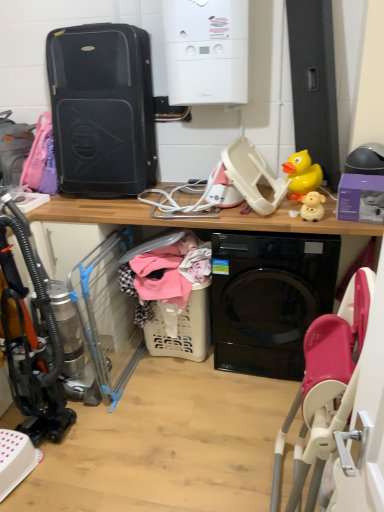
This screenshot has height=512, width=384. What are the coordinates of `white matte sheep at upper right, the 1th toy in the bottom-to-top sequence` in the screenshot? It's located at pos(312,206).

Image resolution: width=384 pixels, height=512 pixels. Describe the element at coordinates (102, 109) in the screenshot. I see `black hard shell suitcase at upper left` at that location.

I want to click on yellow rubber duck at upper right, the second toy positioned from the front, so click(x=302, y=174).

Considering the positions of point (108, 187) and point (309, 205), is point (108, 187) closer or farther from the camera than point (309, 205)?

Clearly, point (108, 187) is more distant from the camera than point (309, 205).

Can you confirm if black hard shell suitcase at upper left is thinner than white matte sheep at upper right, the second toy in the back-to-front sequence?

No.

From a real-world perspective, is black hard shell suitcase at upper left beneath white matte sheep at upper right, the 1th toy in the bottom-to-top sequence?

Actually, black hard shell suitcase at upper left is physically above white matte sheep at upper right, the 1th toy in the bottom-to-top sequence, in the real world.

Which is in front, black hard shell suitcase at upper left or white matte boiler at upper center?

white matte boiler at upper center is more forward.

In the scene shown: Is black hard shell suitcase at upper left thinner than white matte boiler at upper center?

No, black hard shell suitcase at upper left is not thinner than white matte boiler at upper center.

From a real-world perspective, between black hard shell suitcase at upper left and white matte boiler at upper center, who is vertically higher?

white matte boiler at upper center.

Is point (101, 67) more distant than point (178, 49)?

Yes, point (101, 67) is behind point (178, 49).

In terms of height, does black hard shell suitcase at upper left look taller or shorter compared to black glossy washing machine at center?

Considering their sizes, black hard shell suitcase at upper left has less height than black glossy washing machine at center.

From the image's perspective, which is above, black hard shell suitcase at upper left or black glossy washing machine at center?

black hard shell suitcase at upper left, from the image's perspective.

In the scene shown: From a real-world perspective, which object rests below the other?

In real-world perspective, black glossy washing machine at center is lower.

How different are the orientations of black hard shell suitcase at upper left and black glossy washing machine at center in degrees?

They differ by 2.05 degrees in their facing directions.

From a real-world perspective, who is located higher, black glossy washing machine at center or white matte boiler at upper center?

white matte boiler at upper center.

Does point (282, 251) come behind point (166, 9)?

That is True.

Would you say black glossy washing machine at center is outside white matte boiler at upper center?

Yes, black glossy washing machine at center is not within white matte boiler at upper center.

Based on their sizes in the image, would you say black glossy washing machine at center is bigger or smaller than white matte boiler at upper center?

In the image, black glossy washing machine at center appears to be larger than white matte boiler at upper center.

Does point (291, 173) come in front of point (314, 212)?

No, it is behind (314, 212).

At what (x,y) coordinates should I click in order to perform the action: click on toy that is in front of the yellow rubber duck at upper right, the first toy viewed from the top. Please return your answer as a coordinate pair (x, y). The image size is (384, 512). Looking at the image, I should click on (312, 206).

Would you say yellow rubber duck at upper right, acting as the first toy starting from the back, is inside or outside white matte sheep at upper right, the 1th toy in the bottom-to-top sequence?

yellow rubber duck at upper right, acting as the first toy starting from the back, exists outside the volume of white matte sheep at upper right, the 1th toy in the bottom-to-top sequence.

Who is shorter, yellow rubber duck at upper right, the first toy viewed from the top, or white matte sheep at upper right, the 1th toy in the bottom-to-top sequence?

white matte sheep at upper right, the 1th toy in the bottom-to-top sequence, is shorter.

Does yellow rubber duck at upper right, the 2th toy ordered from the bottom, have a larger size compared to black glossy washing machine at center?

No, yellow rubber duck at upper right, the 2th toy ordered from the bottom, is not bigger than black glossy washing machine at center.

From the image's perspective, which is above, yellow rubber duck at upper right, the second toy positioned from the front, or black glossy washing machine at center?

yellow rubber duck at upper right, the second toy positioned from the front, appears higher in the image.

Is yellow rubber duck at upper right, the second toy positioned from the front, placed right next to black glossy washing machine at center?

yellow rubber duck at upper right, the second toy positioned from the front, and black glossy washing machine at center are clearly separated.

Identify the location of washing machine directly beneath the yellow rubber duck at upper right, the second toy positioned from the front (from a real-world perspective). The height and width of the screenshot is (512, 384). (269, 298).

Measure the distance from black glossy washing machine at center to white matte sheep at upper right, the 1th toy in the bottom-to-top sequence.

A distance of 18.63 inches exists between black glossy washing machine at center and white matte sheep at upper right, the 1th toy in the bottom-to-top sequence.

This screenshot has height=512, width=384. Find the location of `the 1st toy behind the black glossy washing machine at center, starting your count from the anchor`. the 1st toy behind the black glossy washing machine at center, starting your count from the anchor is located at coordinates (312, 206).

Are black glossy washing machine at center and white matte sheep at upper right, the second toy in the back-to-front sequence, far apart?

They are positioned close to each other.

Does black glossy washing machine at center contain white matte sheep at upper right, which is the 1th toy from front to back?

No, white matte sheep at upper right, which is the 1th toy from front to back, is located outside of black glossy washing machine at center.

From the image's perspective, count 2nd toys downward from the black hard shell suitcase at upper left and point to it. Please provide its 2D coordinates.

[(312, 206)]

Image resolution: width=384 pixels, height=512 pixels. Find the location of `appliance on the right side of black hard shell suitcase at upper left`. appliance on the right side of black hard shell suitcase at upper left is located at coordinates (206, 51).

When comparing their distances from white matte boiler at upper center, does yellow rubber duck at upper right, the 2th toy ordered from the bottom, or white matte sheep at upper right, which is the 1th toy from front to back, seem further?

white matte sheep at upper right, which is the 1th toy from front to back, is positioned further to the anchor white matte boiler at upper center.

Based on their spatial positions, is yellow rubber duck at upper right, the first toy viewed from the top, or black hard shell suitcase at upper left further from white matte boiler at upper center?

Based on the image, yellow rubber duck at upper right, the first toy viewed from the top, appears to be further to white matte boiler at upper center.

Which object lies further to the anchor point black glossy washing machine at center, black hard shell suitcase at upper left or white matte sheep at upper right, placed as the second toy when sorted from top to bottom?

Among the two, black hard shell suitcase at upper left is located further to black glossy washing machine at center.

Looking at the image, which one is located closer to white matte sheep at upper right, which is the 1th toy from front to back, black glossy washing machine at center or black hard shell suitcase at upper left?

black glossy washing machine at center lies closer to white matte sheep at upper right, which is the 1th toy from front to back, than the other object.

Looking at the image, which one is located closer to black glossy washing machine at center, white matte sheep at upper right, which is the 1th toy from front to back, or yellow rubber duck at upper right, the 2th toy ordered from the bottom?

white matte sheep at upper right, which is the 1th toy from front to back, is closer to black glossy washing machine at center.

Based on their spatial positions, is black hard shell suitcase at upper left or yellow rubber duck at upper right, the 2th toy ordered from the bottom, closer to black glossy washing machine at center?

Based on the image, yellow rubber duck at upper right, the 2th toy ordered from the bottom, appears to be nearer to black glossy washing machine at center.

From the picture: Based on their spatial positions, is black hard shell suitcase at upper left or white matte sheep at upper right, placed as the second toy when sorted from top to bottom, closer to white matte boiler at upper center?

black hard shell suitcase at upper left is closer to white matte boiler at upper center.

In the scene shown: Based on their spatial positions, is yellow rubber duck at upper right, the second toy positioned from the front, or black glossy washing machine at center closer to black hard shell suitcase at upper left?

The object closer to black hard shell suitcase at upper left is black glossy washing machine at center.

Find the location of `toy that lies between white matte boiler at upper center and white matte sheep at upper right, the 1th toy in the bottom-to-top sequence, from top to bottom`. toy that lies between white matte boiler at upper center and white matte sheep at upper right, the 1th toy in the bottom-to-top sequence, from top to bottom is located at coordinates (302, 174).

Locate an element on the screen. This screenshot has height=512, width=384. toy between yellow rubber duck at upper right, the first toy viewed from the top, and black glossy washing machine at center, in the vertical direction is located at coordinates (312, 206).

Identify the location of computer tower between white matte boiler at upper center and black glossy washing machine at center from top to bottom. (102, 109).

I want to click on toy situated between black hard shell suitcase at upper left and yellow rubber duck at upper right, the first toy viewed from the top, from left to right, so click(312, 206).